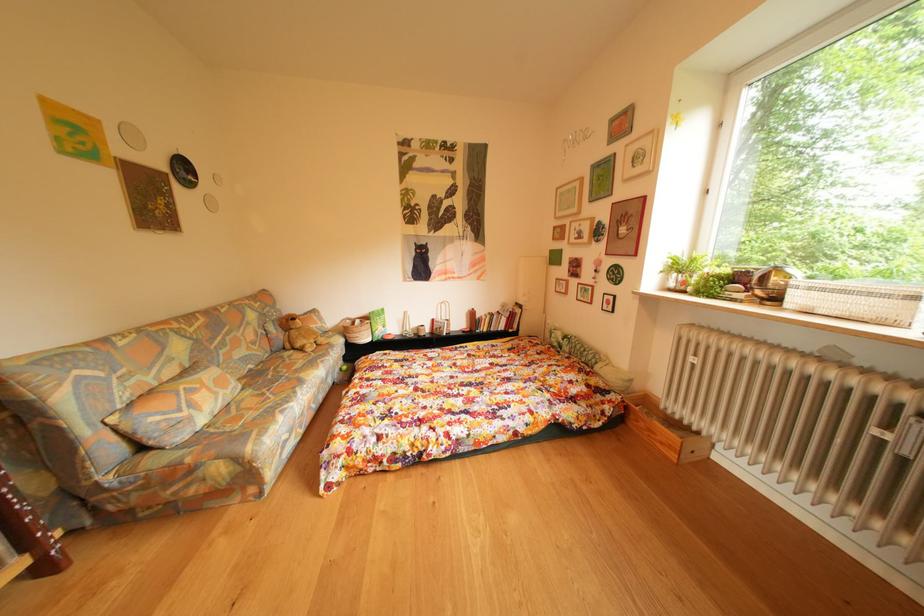
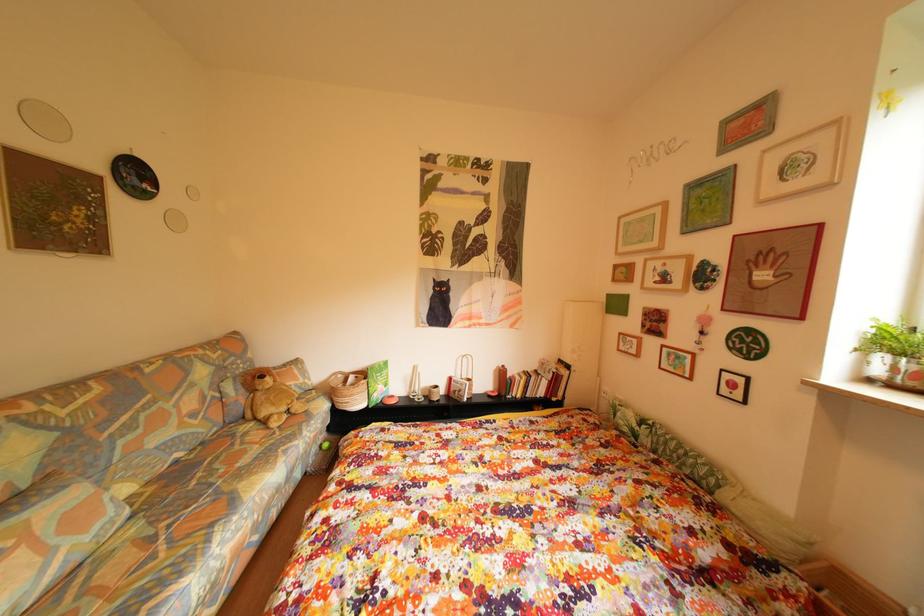
Question: What movement of the cameraman would produce the second image?

Choices:
 (A) Left
 (B) Right
 (C) Forward
 (D) Backward

Answer: (C)